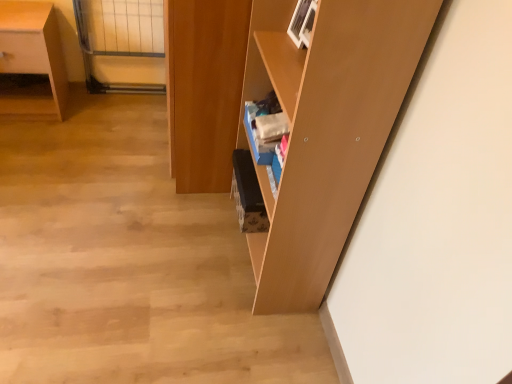
In order to click on free space that is in between wooden cabinet at center and matte wood shelf at center in this screenshot , I will do `click(212, 233)`.